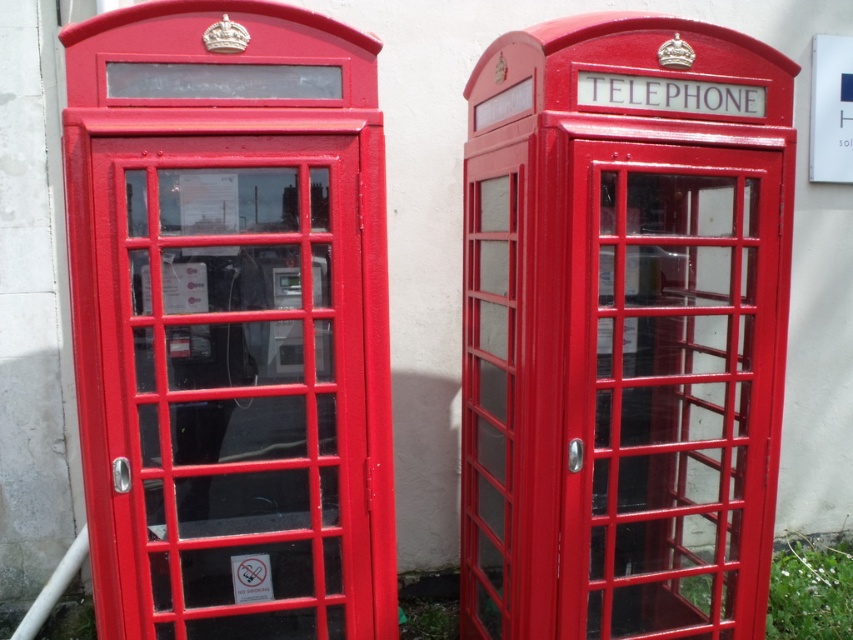
Question: Can you confirm if glossy red telephone booth at center is positioned below metallic red telephone box at left?

Choices:
 (A) no
 (B) yes

Answer: (B)

Question: Observing the image, what is the correct spatial positioning of glossy red telephone booth at center in reference to metallic red telephone box at left?

Choices:
 (A) above
 (B) below

Answer: (B)

Question: Which of the following is the closest to the observer?

Choices:
 (A) glossy red telephone booth at center
 (B) metallic red telephone box at left

Answer: (A)

Question: Which point is closer to the camera?

Choices:
 (A) glossy red telephone booth at center
 (B) metallic red telephone box at left

Answer: (A)

Question: Which point is farther to the camera?

Choices:
 (A) (567, 512)
 (B) (271, 301)

Answer: (A)

Question: Is glossy red telephone booth at center positioned in front of metallic red telephone box at left?

Choices:
 (A) no
 (B) yes

Answer: (B)